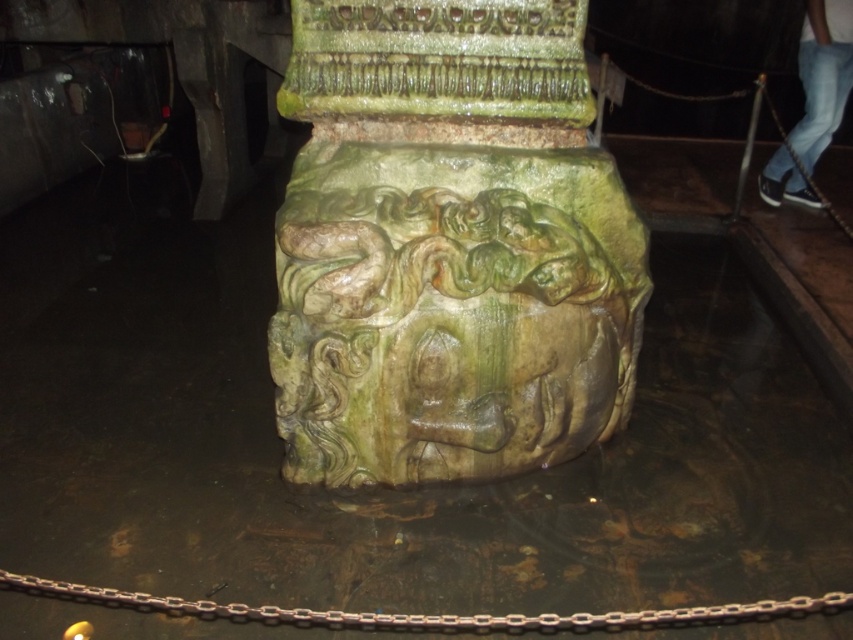
You are an architect examining the carved stone pedestal. You notice two points marked on the pedestal. The first point is at coordinates point (373,452) and the second is at point (641,611). From your vantage point, which point is closer to you?

Point (373,452) is closer to you because it is further to the viewer than point (641,611).

You are an archaeologist examining the pedestal. You notice the green marble statue at center and the rusty metal chain at lower center. Based on their positions, which one is located higher up?

The green marble statue at center is above the rusty metal chain at lower center, so it is located higher up.

Based on the photo, you are an architect inspecting a stone pedestal. You notice a point marked at coordinates (448, 244). What object is located at that point?

The point at coordinates (448, 244) indicates the location of the green marble statue at center.